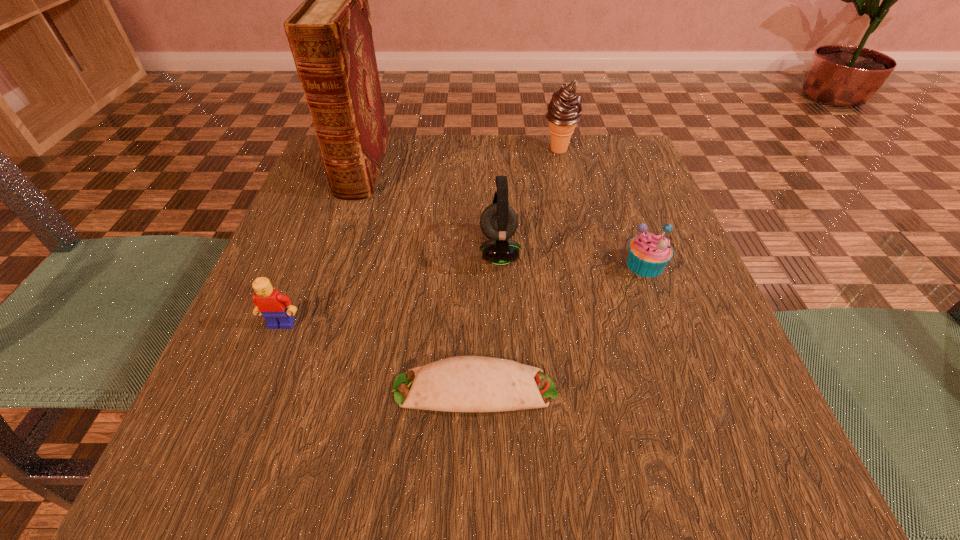
Locate an element on the screen. vacant region at the far right corner of the desktop is located at coordinates (633, 141).

Identify the location of unoccupied area between the fourth tallest object and the second shortest object. click(464, 294).

Identify the location of free space between the tallest object and the fifth farthest object. This screenshot has width=960, height=540. (322, 246).

Find the location of a particular element. Image resolution: width=960 pixels, height=540 pixels. free spot between the headset and the tallest object is located at coordinates (430, 208).

Locate an element on the screen. The height and width of the screenshot is (540, 960). free space between the icecream and the tallest object is located at coordinates (461, 158).

Find the location of a particular element. free point between the icecream and the burrito is located at coordinates (517, 269).

This screenshot has height=540, width=960. Identify the location of empty space between the fourth shortest object and the rightmost object. (572, 258).

Find the location of a particular element. vacant space that's between the hardback book and the headset is located at coordinates (430, 208).

Where is `free space that is in between the shortest object and the tallest object`? Image resolution: width=960 pixels, height=540 pixels. free space that is in between the shortest object and the tallest object is located at coordinates [419, 278].

At what (x,y) coordinates should I click in order to perform the action: click on unoccupied area between the Lego and the tallest object. Please return your answer as a coordinate pair (x, y). Image resolution: width=960 pixels, height=540 pixels. Looking at the image, I should click on (322, 246).